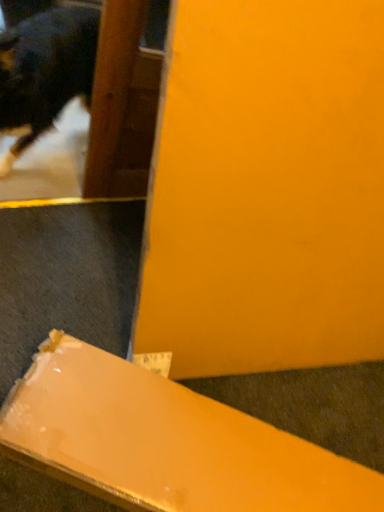
The image size is (384, 512). In order to click on smooth orange cheese at lower left in this screenshot , I will do `click(166, 442)`.

What do you see at coordinates (166, 442) in the screenshot? I see `smooth orange cheese at lower left` at bounding box center [166, 442].

Locate an element on the screen. Image resolution: width=384 pixels, height=512 pixels. smooth orange cheese at lower left is located at coordinates pos(166,442).